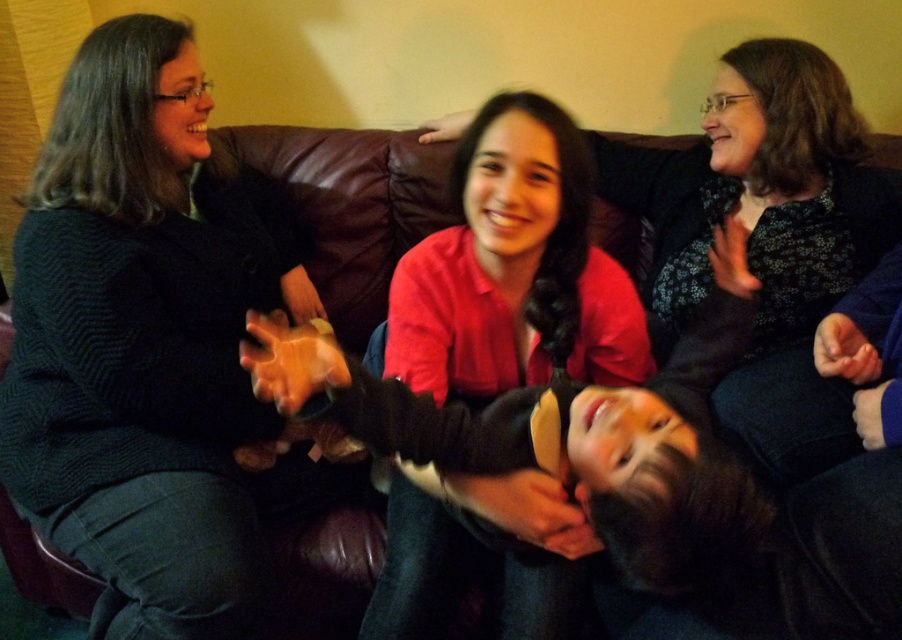
You are a photographer setting up a shoot in the living room. You want to ensure that both the black sweater at left and the matte red shirt at center are visible in the frame. Based on their positions, which clothing item should be placed closer to the camera to ensure both are visible?

The matte red shirt at center is behind the black sweater at left, so to ensure both are visible, the black sweater at left should be placed closer to the camera. This way, the matte red shirt at center won not be obscured by the black sweater at left.

From the picture: You are a photographer setting up for a group photo. You notice the black sweater at left and the matte red shirt at center. Which clothing item is covering part of the other?

The black sweater at left is positioned over the matte red shirt at center, so it is covering part of it.